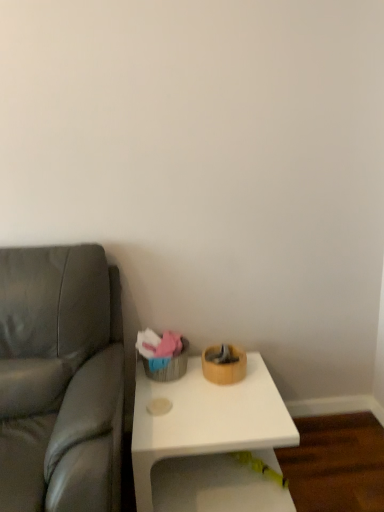
I want to click on suede gray couch at left, so pyautogui.click(x=60, y=380).

The image size is (384, 512). What do you see at coordinates (60, 380) in the screenshot?
I see `suede gray couch at left` at bounding box center [60, 380].

The height and width of the screenshot is (512, 384). What do you see at coordinates (209, 442) in the screenshot? I see `white matte table at center` at bounding box center [209, 442].

In order to face white matte table at center, should I rotate leftwards or rightwards?

You should rotate right by 2.226 degrees.

Identify the location of white matte table at center. (209, 442).

This screenshot has height=512, width=384. Find the location of `suede gray couch at left`. suede gray couch at left is located at coordinates (60, 380).

Is white matte table at center to the left of suede gray couch at left from the viewer's perspective?

No, white matte table at center is not to the left of suede gray couch at left.

Does white matte table at center come in front of suede gray couch at left?

No, the depth of white matte table at center is greater than that of suede gray couch at left.

Is point (138, 387) closer or farther from the camera than point (98, 258)?

Point (138, 387) appears to be farther away from the viewer than point (98, 258).

From the image's perspective, which one is positioned higher, white matte table at center or suede gray couch at left?

suede gray couch at left is shown above in the image.

From a real-world perspective, is white matte table at center located beneath suede gray couch at left?

Yes, from a real-world perspective, white matte table at center is beneath suede gray couch at left.

Which object is thinner, white matte table at center or suede gray couch at left?

With smaller width is white matte table at center.

Who is taller, white matte table at center or suede gray couch at left?

suede gray couch at left.

Who is bigger, white matte table at center or suede gray couch at left?

With larger size is suede gray couch at left.

Is white matte table at center located outside suede gray couch at left?

Absolutely, white matte table at center is external to suede gray couch at left.

Does white matte table at center touch suede gray couch at left?

No, white matte table at center is not beside suede gray couch at left.

Could you tell me if white matte table at center is turned towards suede gray couch at left?

No, white matte table at center is not aimed at suede gray couch at left.

This screenshot has width=384, height=512. In order to click on table on the right of suede gray couch at left in this screenshot , I will do `click(209, 442)`.

Considering the relative positions of suede gray couch at left and white matte table at center in the image provided, is suede gray couch at left to the right of white matte table at center from the viewer's perspective?

No, suede gray couch at left is not to the right of white matte table at center.

Considering their positions, is suede gray couch at left located in front of or behind white matte table at center?

suede gray couch at left is in front of white matte table at center.

Is point (27, 481) farther from camera compared to point (197, 380)?

No, it is not.

From the image's perspective, which is above, suede gray couch at left or white matte table at center?

suede gray couch at left appears higher in the image.

From a real-world perspective, which is physically above, suede gray couch at left or white matte table at center?

In real-world perspective, suede gray couch at left is above.

Considering the relative sizes of suede gray couch at left and white matte table at center in the image provided, is suede gray couch at left thinner than white matte table at center?

Incorrect, the width of suede gray couch at left is not less than that of white matte table at center.

From their relative heights in the image, would you say suede gray couch at left is taller or shorter than white matte table at center?

Considering their sizes, suede gray couch at left has more height than white matte table at center.

Who is bigger, suede gray couch at left or white matte table at center?

suede gray couch at left.

Is white matte table at center inside suede gray couch at left?

No, suede gray couch at left does not contain white matte table at center.

Would you say suede gray couch at left is a long distance from white matte table at center?

Actually, suede gray couch at left and white matte table at center are a little close together.

From the picture: Is suede gray couch at left oriented towards white matte table at center?

No, suede gray couch at left is not facing towards white matte table at center.

In order to click on studio couch on the left of white matte table at center in this screenshot , I will do `click(60, 380)`.

Locate an element on the screen. The image size is (384, 512). table on the right of suede gray couch at left is located at coordinates (209, 442).

This screenshot has height=512, width=384. Identify the location of studio couch above the white matte table at center (from a real-world perspective). (60, 380).